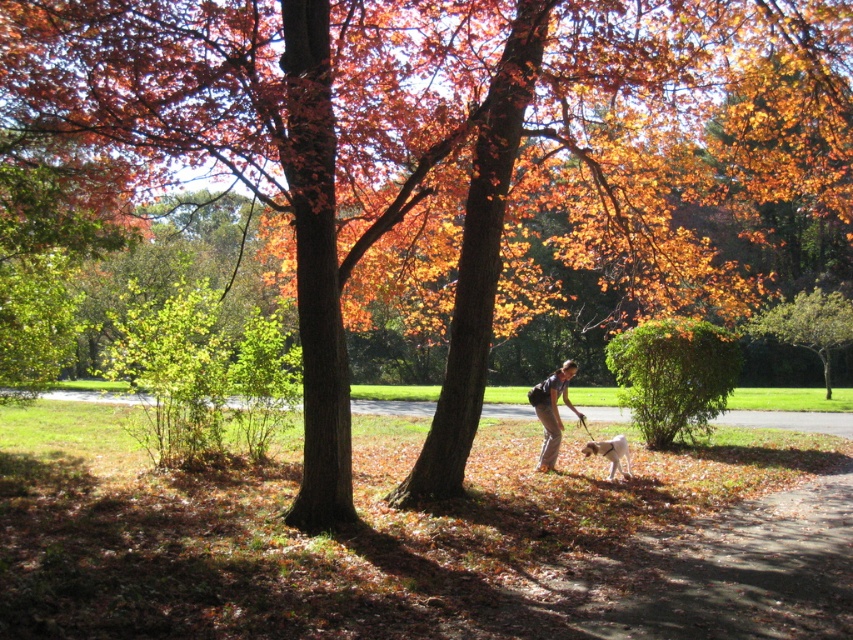
Question: Which object appears closest to the camera in this image?

Choices:
 (A) green leafy tree at center
 (B) dark gray fabric pants at center
 (C) green leafy bush at center

Answer: (B)

Question: Which of these objects is positioned closest to the dark gray fabric pants at center?

Choices:
 (A) green leafy tree at center
 (B) green leafy bush at center

Answer: (B)

Question: Is the position of green leafy bush at center more distant than that of brown fur dog at lower center?

Choices:
 (A) yes
 (B) no

Answer: (A)

Question: Does green leafy tree at center have a smaller size compared to brown fur dog at lower center?

Choices:
 (A) no
 (B) yes

Answer: (A)

Question: Which point is closer to the camera taking this photo?

Choices:
 (A) (563, 371)
 (B) (585, 452)
 (C) (781, 305)

Answer: (B)

Question: Is dark gray fabric pants at center bigger than brown fur dog at lower center?

Choices:
 (A) no
 (B) yes

Answer: (B)